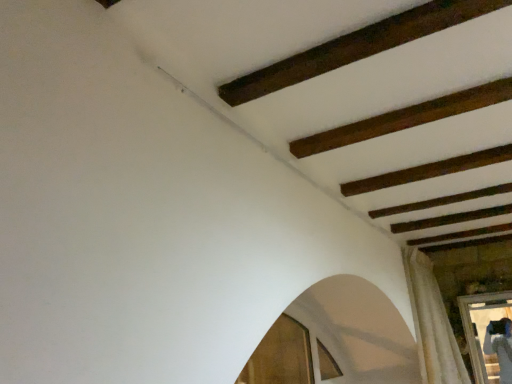
Question: Is white textured curtain at lower right located outside wooden frame at lower right?

Choices:
 (A) yes
 (B) no

Answer: (A)

Question: Is white textured curtain at lower right positioned with its back to wooden frame at lower right?

Choices:
 (A) no
 (B) yes

Answer: (A)

Question: From a real-world perspective, is white textured curtain at lower right physically above wooden frame at lower right?

Choices:
 (A) no
 (B) yes

Answer: (B)

Question: Could you tell me if white textured curtain at lower right is turned towards wooden frame at lower right?

Choices:
 (A) yes
 (B) no

Answer: (A)

Question: Is white textured curtain at lower right with wooden frame at lower right?

Choices:
 (A) yes
 (B) no

Answer: (B)

Question: Is white textured curtain at lower right far from wooden frame at lower right?

Choices:
 (A) no
 (B) yes

Answer: (A)

Question: From the image's perspective, is wooden frame at lower right above white textured curtain at lower right?

Choices:
 (A) yes
 (B) no

Answer: (B)

Question: Considering the relative sizes of wooden frame at lower right and white textured curtain at lower right in the image provided, is wooden frame at lower right bigger than white textured curtain at lower right?

Choices:
 (A) no
 (B) yes

Answer: (A)

Question: Is wooden frame at lower right thinner than white textured curtain at lower right?

Choices:
 (A) no
 (B) yes

Answer: (B)

Question: Is wooden frame at lower right not inside white textured curtain at lower right?

Choices:
 (A) no
 (B) yes

Answer: (B)

Question: Considering the relative sizes of wooden frame at lower right and white textured curtain at lower right in the image provided, is wooden frame at lower right taller than white textured curtain at lower right?

Choices:
 (A) no
 (B) yes

Answer: (A)

Question: Considering the relative sizes of wooden frame at lower right and white textured curtain at lower right in the image provided, is wooden frame at lower right wider than white textured curtain at lower right?

Choices:
 (A) yes
 (B) no

Answer: (B)

Question: In terms of size, does wooden frame at lower right appear bigger or smaller than white textured curtain at lower right?

Choices:
 (A) big
 (B) small

Answer: (B)